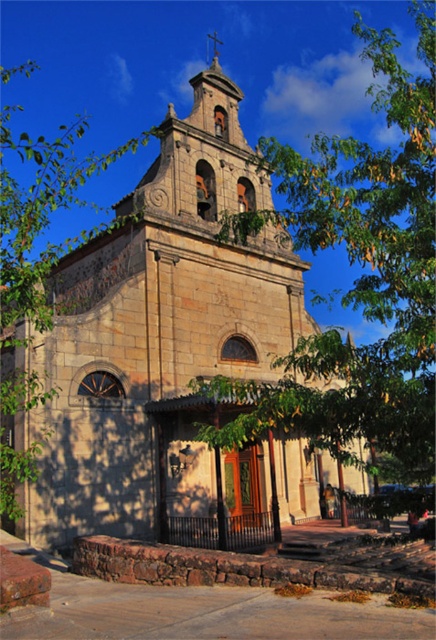
Question: Observing the image, what is the correct spatial positioning of stone church at center in reference to green leafy tree at left?

Choices:
 (A) above
 (B) below

Answer: (B)

Question: Among these points, which one is nearest to the camera?

Choices:
 (A) (74, 400)
 (B) (23, 308)

Answer: (B)

Question: Among these points, which one is nearest to the camera?

Choices:
 (A) (249, 195)
 (B) (31, 316)

Answer: (B)

Question: Is stone church at center thinner than green leafy tree at center?

Choices:
 (A) no
 (B) yes

Answer: (B)

Question: Which object is the closest to the green leafy tree at left?

Choices:
 (A) green leafy tree at center
 (B) stone church at center

Answer: (B)

Question: Does green leafy tree at center appear on the right side of green leafy tree at left?

Choices:
 (A) yes
 (B) no

Answer: (A)